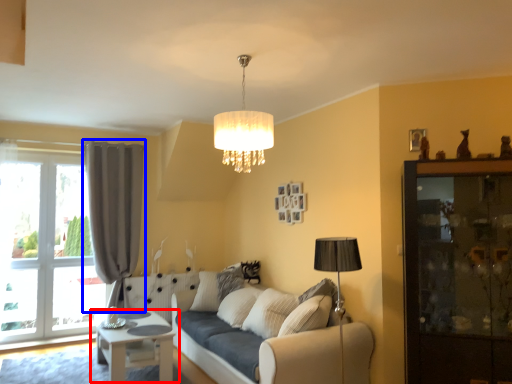
Question: Which object is closer to the camera taking this photo, table (highlighted by a red box) or curtain (highlighted by a blue box)?

Choices:
 (A) table
 (B) curtain

Answer: (A)